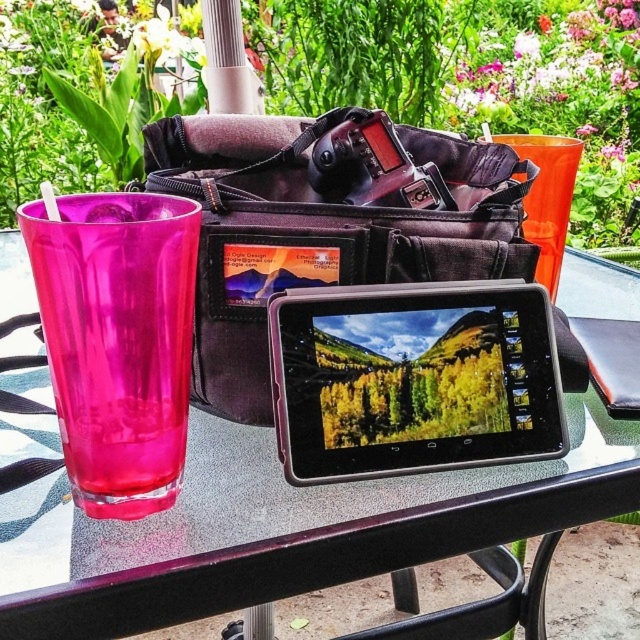
You are a photographer setting up your equipment. You have a transparent glass at upper left and a matte black bag at center on your table. Which object should you avoid placing heavy items on to prevent damage?

You should avoid placing heavy items on the transparent glass at upper left because it is larger in size than the matte black bag at center and might not be as sturdy.

You are setting up a photography session and need to place your equipment. You have a matte black bag at center and a transparent plastic cup at left on the table. Which object should you move first if you need more space for your camera gear?

The matte black bag at center has a larger size compared to the transparent plastic cup at left, so you should move the transparent plastic cup at left first to free up more space quickly.

You are a photographer who needs to place a 30 cm long tripod between the transparent glass at upper left and the camera. Is there enough space?

The distance between the transparent glass at upper left and the camera is 32.63 centimeters, so yes, the tripod can be placed there as it is longer than the tripod length.